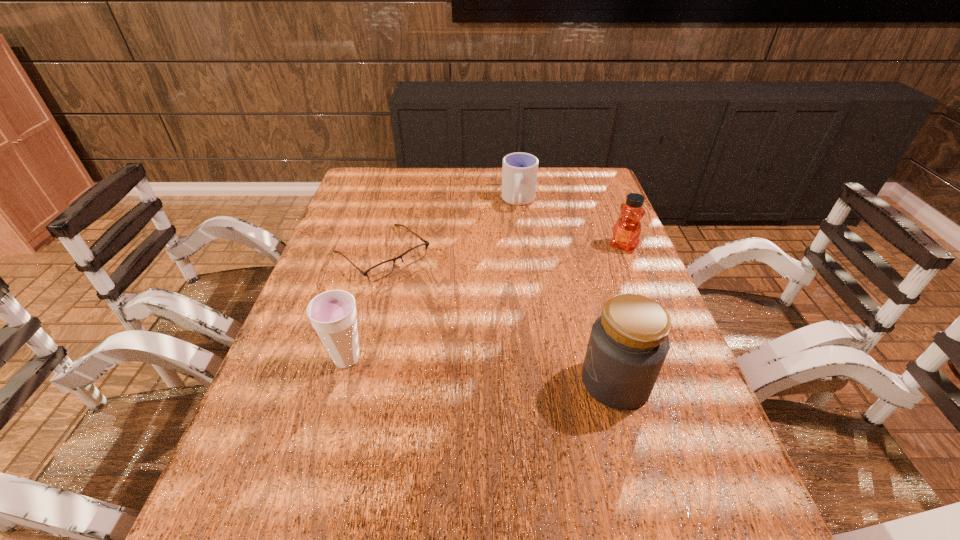
Find the location of a particular element. Image resolution: width=960 pixels, height=540 pixels. blank area located 0.130m on the surface of the jar near the warning symbol is located at coordinates (519, 382).

The height and width of the screenshot is (540, 960). Identify the location of free space located 0.260m on the surface of the jar near the warning symbol. (458, 382).

The width and height of the screenshot is (960, 540). Identify the location of free space located 0.070m with the handle on the side of the shorter cup. (514, 226).

At what (x,y) coordinates should I click in order to perform the action: click on vacant point located 0.340m with the handle on the side of the shorter cup. Please return your answer as a coordinate pair (x, y). This screenshot has width=960, height=540. Looking at the image, I should click on (497, 283).

Where is `vacant point located 0.210m with the handle on the side of the shorter cup`? This screenshot has height=540, width=960. vacant point located 0.210m with the handle on the side of the shorter cup is located at coordinates (506, 253).

This screenshot has height=540, width=960. In order to click on free location located on the front-facing side of the shortest object in this screenshot , I will do `click(438, 304)`.

Locate an element on the screen. Image resolution: width=960 pixels, height=540 pixels. vacant point located 0.070m on the front-facing side of the shortest object is located at coordinates (424, 292).

Locate an element on the screen. blank space located 0.150m on the front-facing side of the shortest object is located at coordinates (443, 308).

Identify the location of vacant space located on the front label of the rightmost object. This screenshot has width=960, height=540. [584, 294].

Find the location of `free space located on the front label of the rightmost object`. free space located on the front label of the rightmost object is located at coordinates (549, 336).